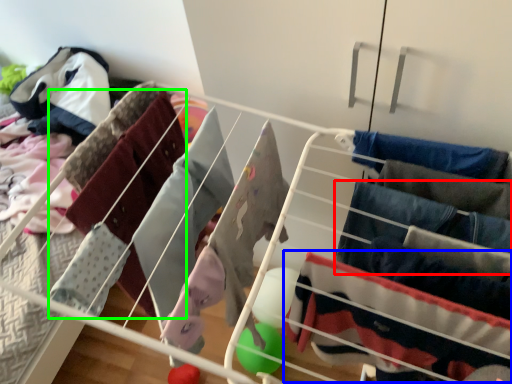
Question: Which object is positioned farthest from clothing (highlighted by a red box)? Select from clothing (highlighted by a blue box) and clothing (highlighted by a green box).

Choices:
 (A) clothing
 (B) clothing

Answer: (B)